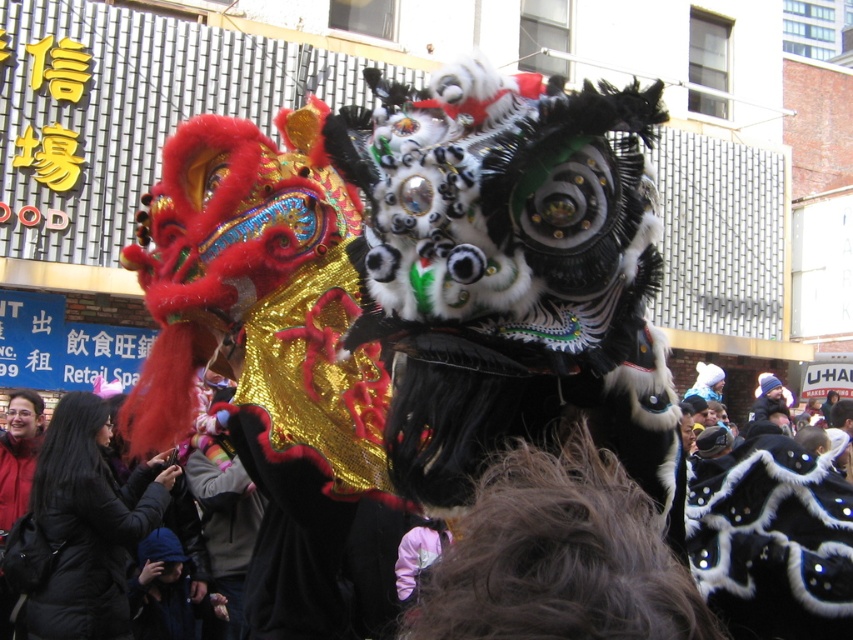
Who is taller, black sequined mask at center or velvet black coat at lower left?

Standing taller between the two is black sequined mask at center.

Between point (782, 440) and point (93, 588), which one is positioned in front?

Point (782, 440) is more forward.

The height and width of the screenshot is (640, 853). I want to click on black sequined mask at center, so click(x=773, y=541).